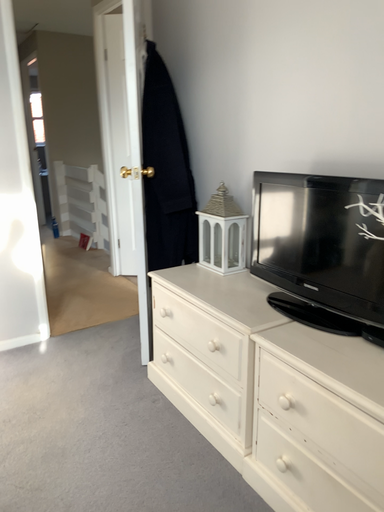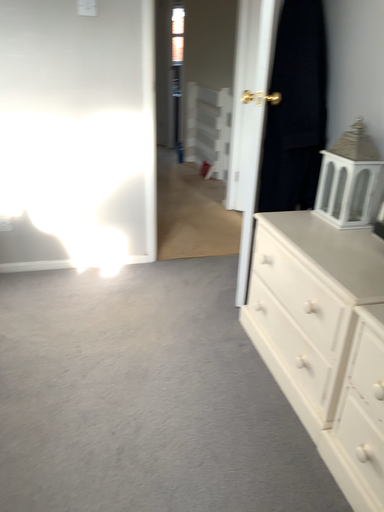
Question: Which way did the camera rotate in the video?

Choices:
 (A) rotated right
 (B) rotated left

Answer: (B)